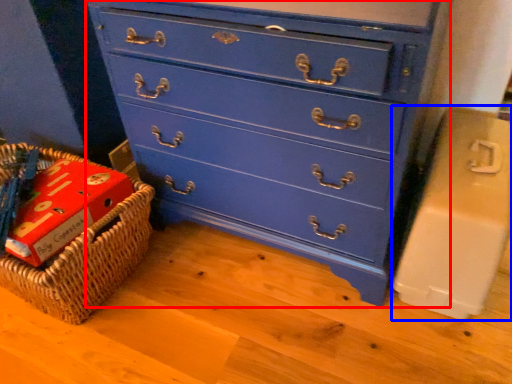
Question: Which object appears closest to the camera in this image, chest of drawers (highlighted by a red box) or cardboard box (highlighted by a blue box)?

Choices:
 (A) chest of drawers
 (B) cardboard box

Answer: (A)